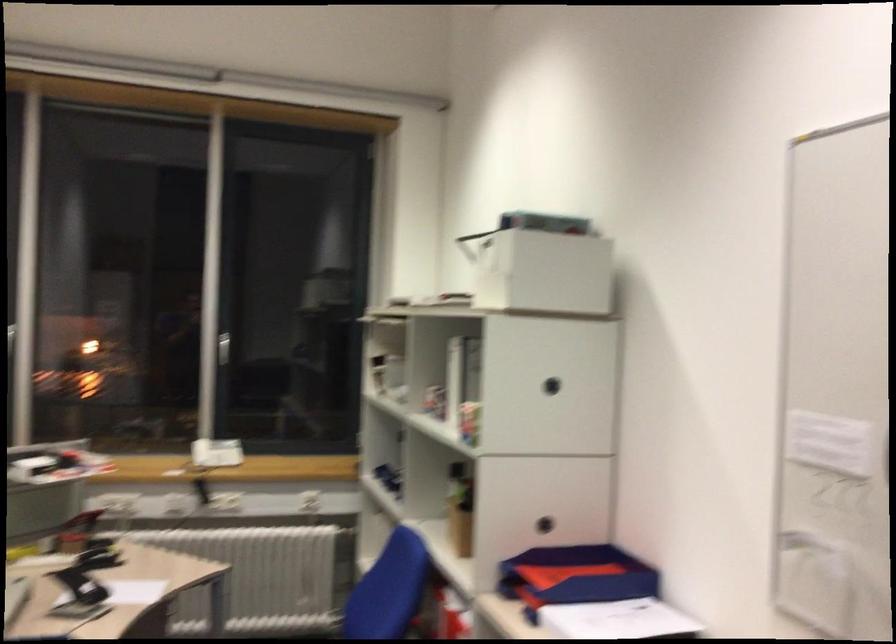
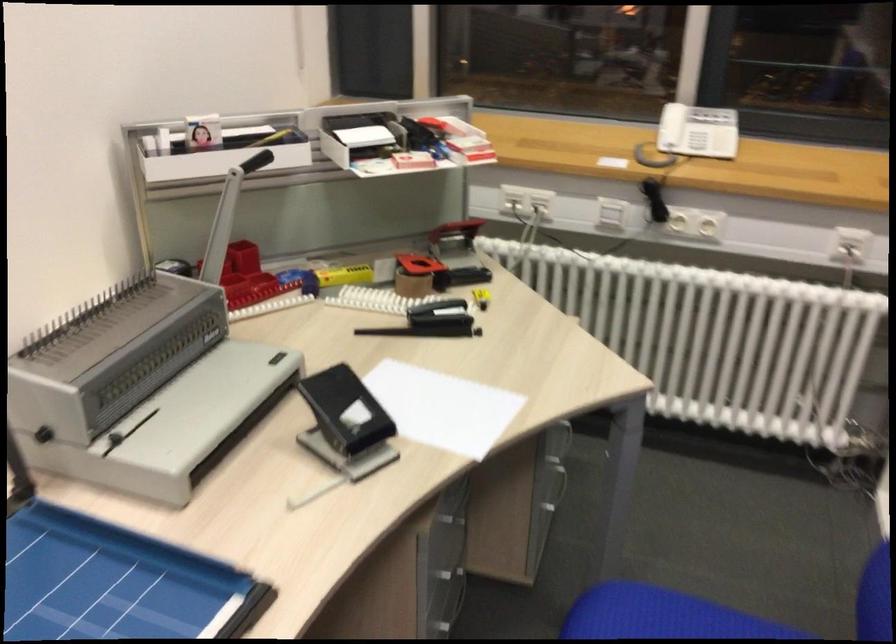
Find the pixel in the second image that matches the point at 85,567 in the first image.

(431, 321)